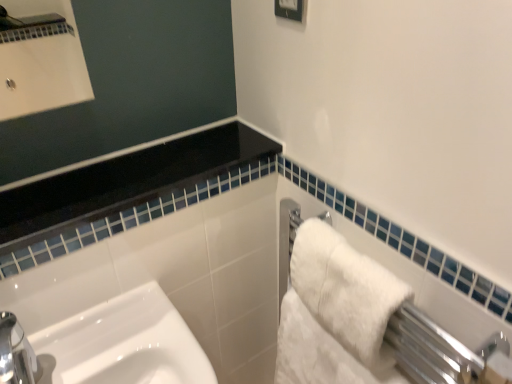
Question: In terms of width, does white glossy frame at upper center look wider or thinner when compared to white fluffy bath towel at right, the first bath towel in the top-to-bottom sequence?

Choices:
 (A) wide
 (B) thin

Answer: (B)

Question: Is point (295, 1) closer or farther from the camera than point (388, 365)?

Choices:
 (A) farther
 (B) closer

Answer: (B)

Question: Estimate the real-world distances between objects in this image. Which object is farther from the white fluffy bath towel at right, the second bath towel in the top-to-bottom sequence?

Choices:
 (A) white fluffy bath towel at right, the first bath towel in the top-to-bottom sequence
 (B) white glossy frame at upper center

Answer: (B)

Question: Estimate the real-world distances between objects in this image. Which object is closer to the white glossy frame at upper center?

Choices:
 (A) white fluffy bath towel at right, which is counted as the 2th bath towel, starting from the bottom
 (B) white fluffy bath towel at right, arranged as the 1th bath towel when ordered from the bottom

Answer: (A)